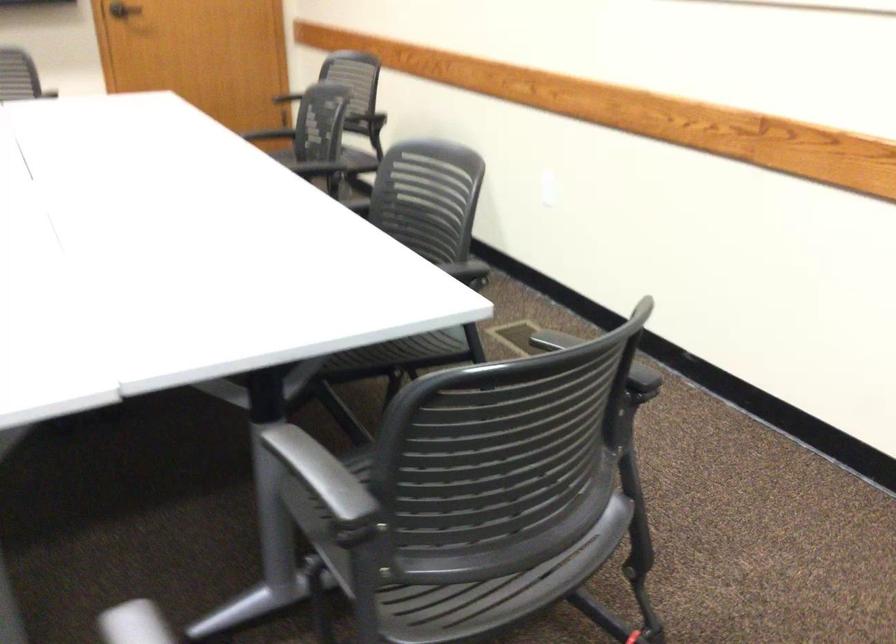
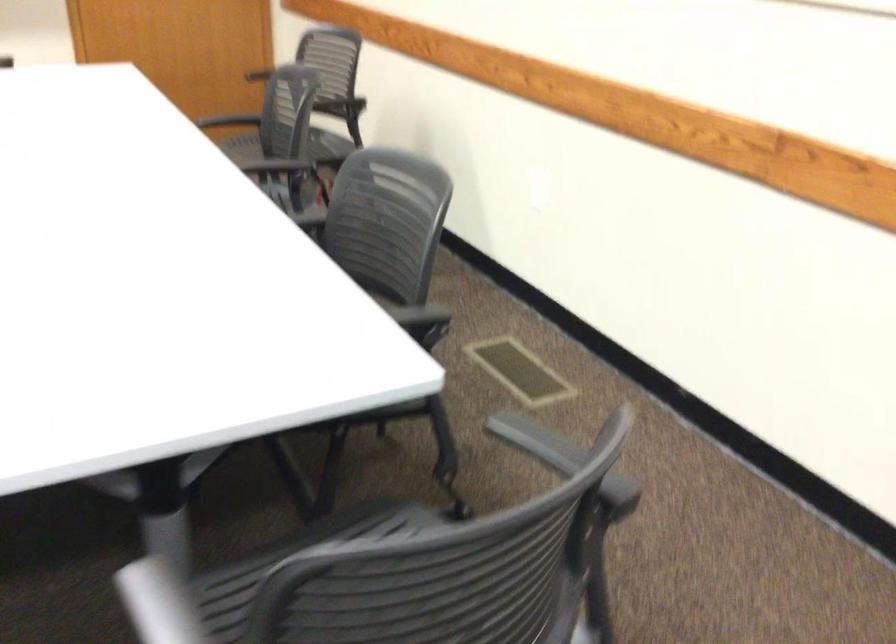
Question: In a continuous first-person perspective shot, in which direction is the camera moving?

Choices:
 (A) Left
 (B) Right
 (C) Forward
 (D) Backward

Answer: (C)